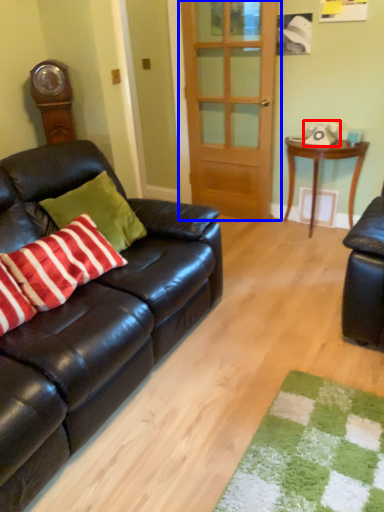
Question: Which object appears closest to the camera in this image, corded phone (highlighted by a red box) or door (highlighted by a blue box)?

Choices:
 (A) corded phone
 (B) door

Answer: (B)